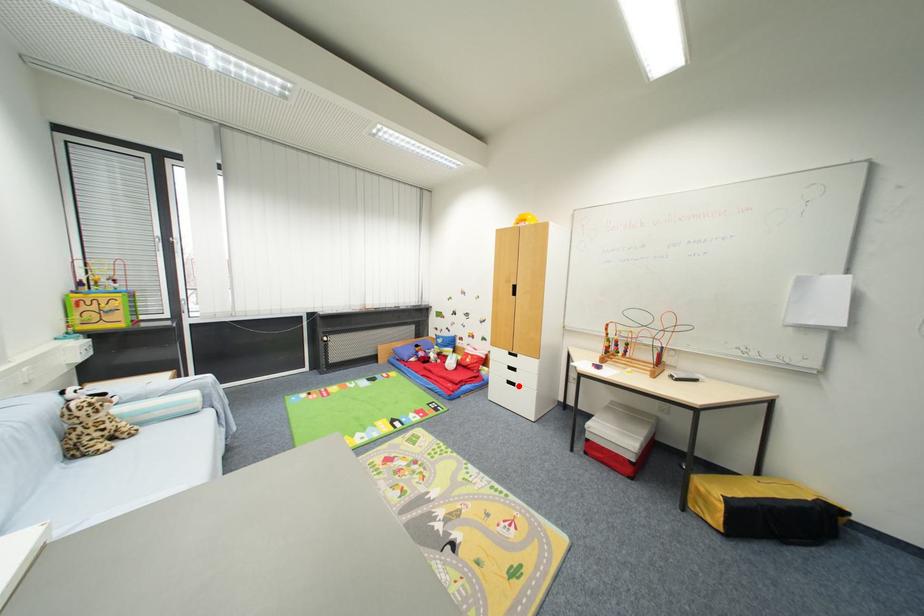
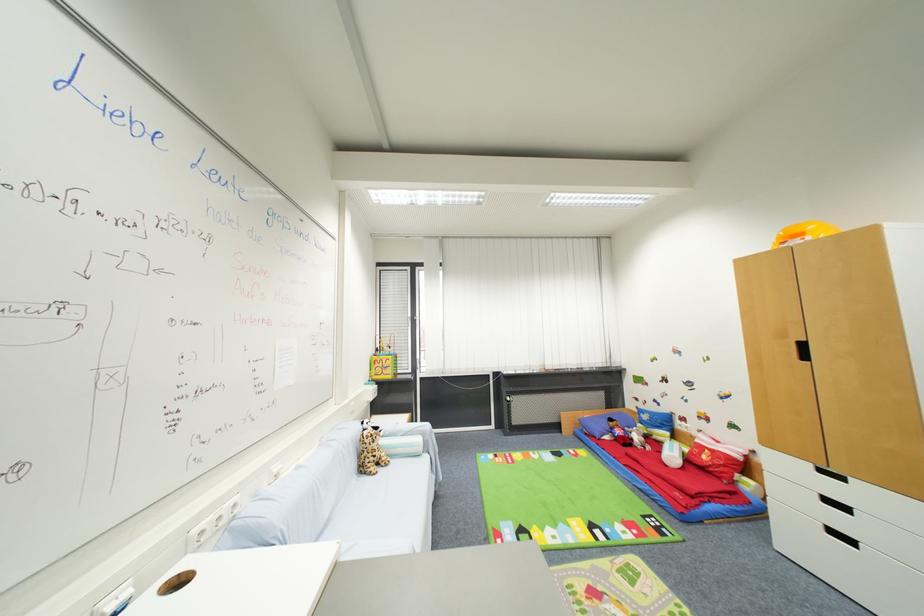
Find the pixel in the second image that matches the highlighted location in the first image.

(857, 544)